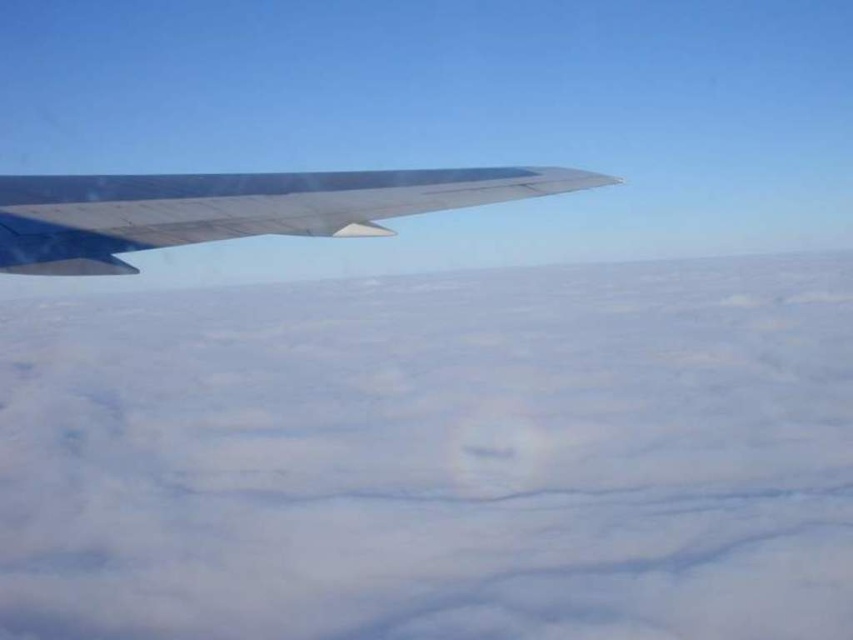
The height and width of the screenshot is (640, 853). What do you see at coordinates (434, 456) in the screenshot? I see `white fluffy cloud at upper left` at bounding box center [434, 456].

Does white fluffy cloud at upper left lie in front of metallic gray wing at upper left?

No.

The image size is (853, 640). Find the location of `white fluffy cloud at upper left`. white fluffy cloud at upper left is located at coordinates (434, 456).